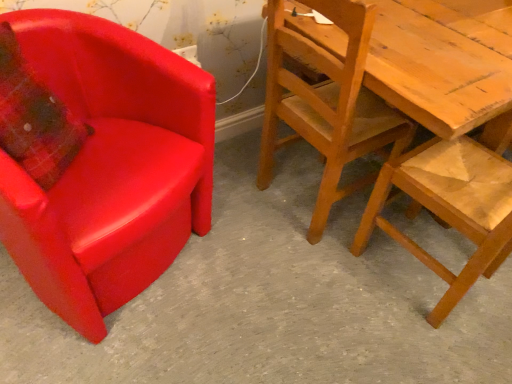
Locate an element on the screen. Image resolution: width=512 pixels, height=384 pixels. vacant space in front of wooden textured chair at right, which is the 1th chair from right to left is located at coordinates (426, 343).